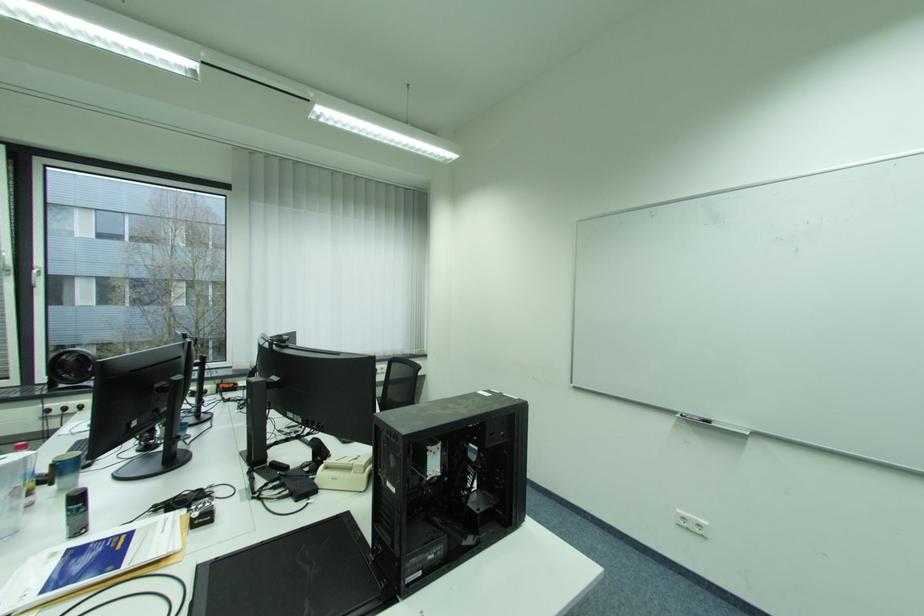
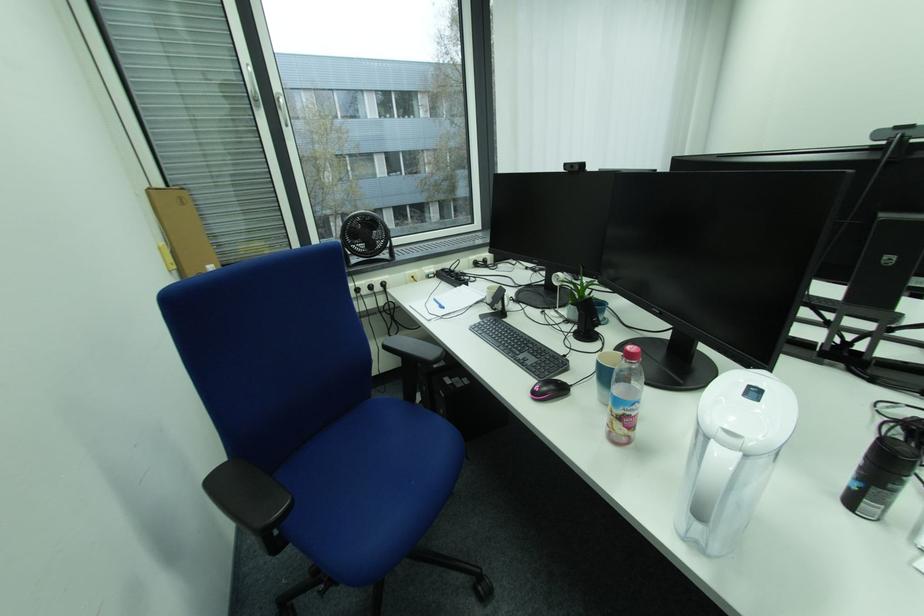
Question: Which direction would the cameraman need to move to produce the second image? Reply with the corresponding letter.

Choices:
 (A) Left
 (B) Right
 (C) Forward
 (D) Backward

Answer: (A)